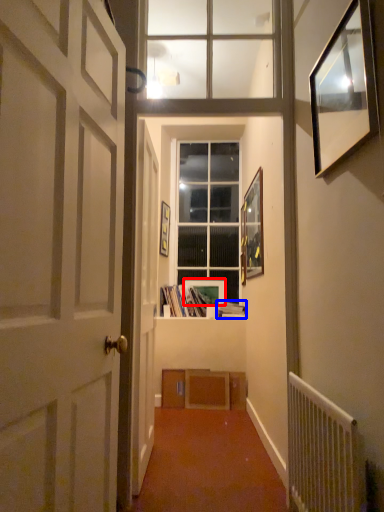
Question: Which object appears farthest to the camera in this image, picture frame (highlighted by a red box) or book (highlighted by a blue box)?

Choices:
 (A) picture frame
 (B) book

Answer: (A)